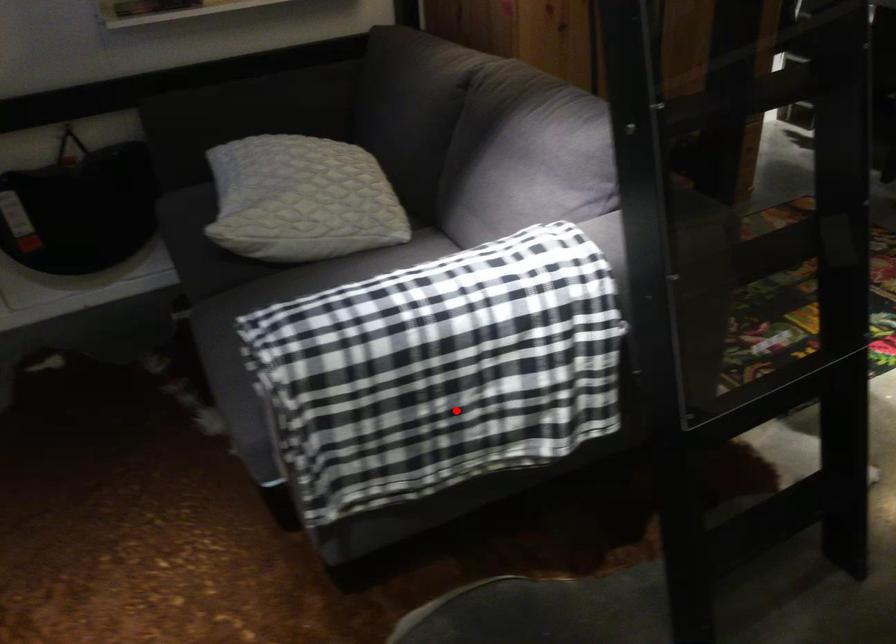
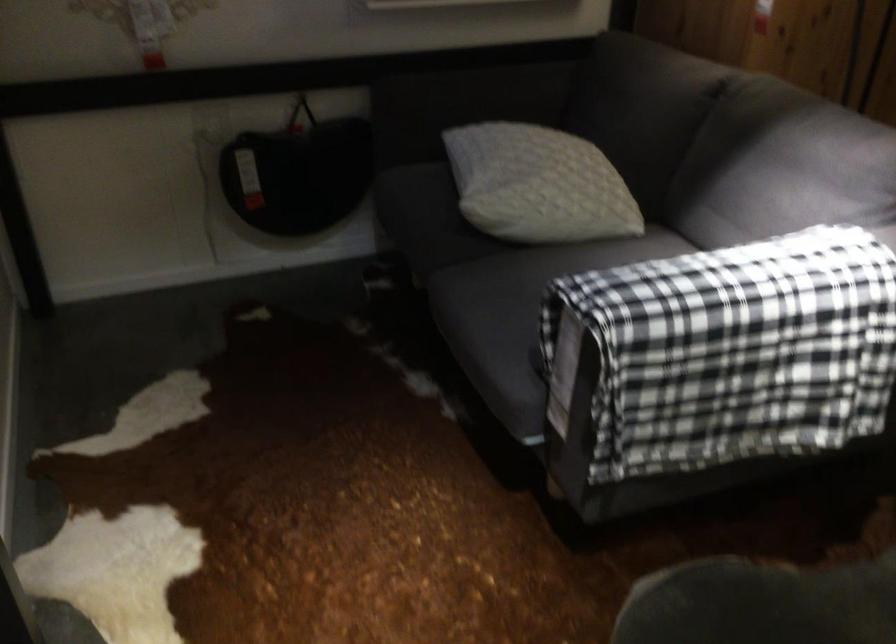
Locate, in the second image, the point that corresponds to the highlighted location in the first image.

(745, 388)